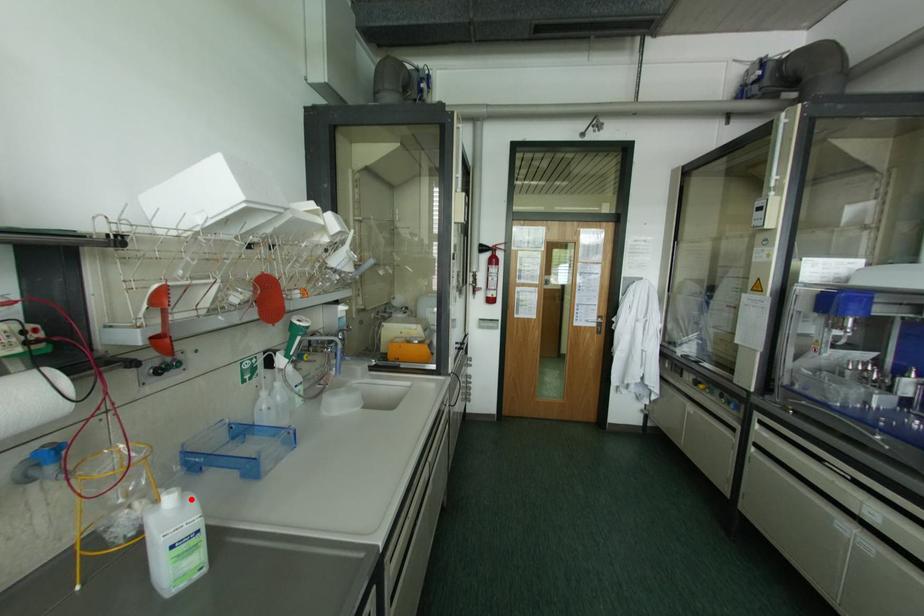
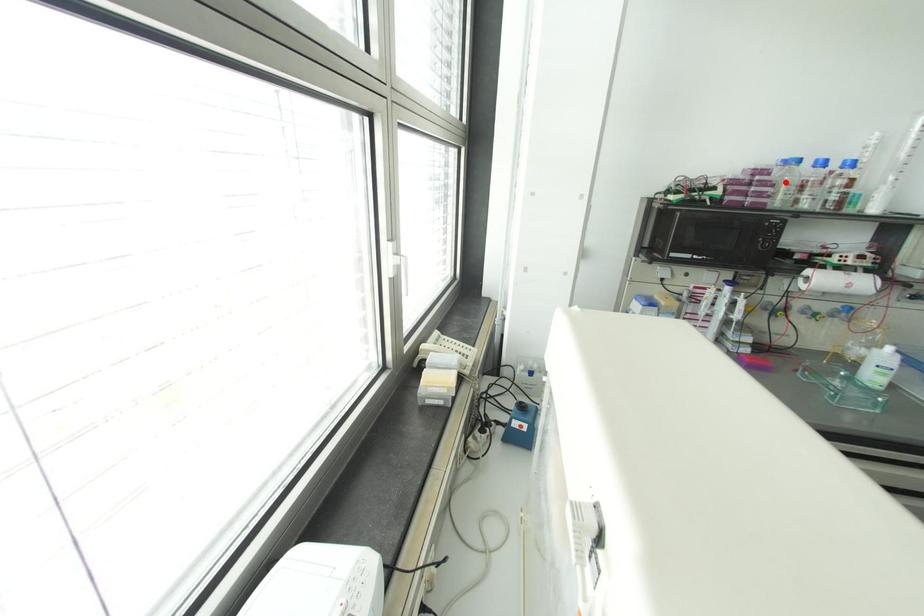
I am providing you with two images of the same scene from different viewpoints. A red point is marked on the first image and another point is marked on the second image. Does the point marked in image1 correspond to the same location as the one in image2?

No